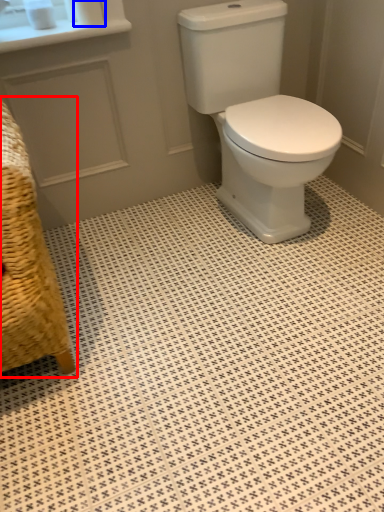
Question: Which point is further to the camera, armchair (highlighted by a red box) or toilet paper (highlighted by a blue box)?

Choices:
 (A) armchair
 (B) toilet paper

Answer: (B)